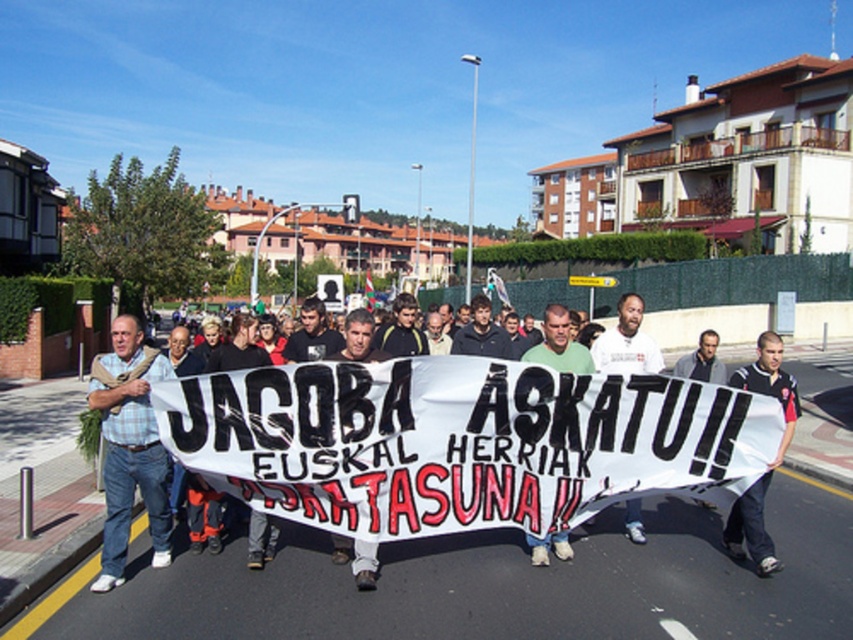
Question: Among these objects, which one is farthest from the camera?

Choices:
 (A) green cotton shirt at center
 (B) black jersey at center

Answer: (A)

Question: Considering the real-world distances, which object is farthest from the plaid shirt at left?

Choices:
 (A) black jersey at center
 (B) dark gray shirt at center
 (C) green cotton shirt at center

Answer: (A)

Question: Can you confirm if matte black banner at center is bigger than dark gray shirt at center?

Choices:
 (A) yes
 (B) no

Answer: (B)

Question: Considering the relative positions of black jersey at center and matte black banner at center in the image provided, where is black jersey at center located with respect to matte black banner at center?

Choices:
 (A) below
 (B) above

Answer: (A)

Question: Is black jersey at center further to the viewer compared to dark gray shirt at center?

Choices:
 (A) yes
 (B) no

Answer: (B)

Question: Which of these objects is positioned farthest from the dark gray shirt at center?

Choices:
 (A) white cotton t-shirt at center
 (B) green cotton shirt at center
 (C) plaid shirt at left
 (D) matte black banner at center

Answer: (C)